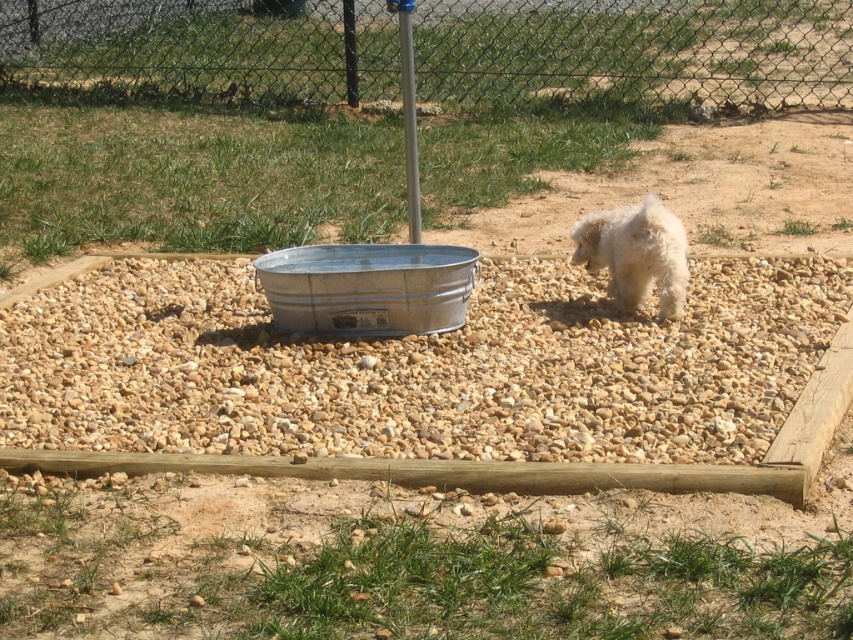
In the scene shown: You are standing in the outdoor scene and want to know the exact location of the metal mesh fence at upper center. Can you determine its coordinates?

The metal mesh fence at upper center is located at point (636, 51).

You are a small dog owner who wants to ensure your dog can see over the metal mesh fence at upper center while drinking from the galvanized metal tub at center. Based on the scene, is the fence taller than the tub?

The metal mesh fence at upper center is taller than the galvanized metal tub at center, so yes, the fence is taller than the tub.